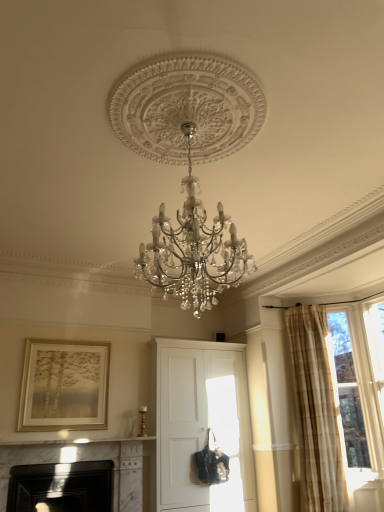
Question: Should I look upward or downward to see black marble fireplace at lower left, the 1th fireplace positioned from the left?

Choices:
 (A) up
 (B) down

Answer: (B)

Question: Is black marble fireplace at lower left, the 1th fireplace positioned from the left, further to the viewer compared to white marble fireplace at lower left, placed as the second fireplace when sorted from left to right?

Choices:
 (A) no
 (B) yes

Answer: (B)

Question: From the image's perspective, does black marble fireplace at lower left, the 1th fireplace positioned from the left, appear lower than white marble fireplace at lower left, placed as the second fireplace when sorted from left to right?

Choices:
 (A) yes
 (B) no

Answer: (A)

Question: Is black marble fireplace at lower left, arranged as the second fireplace when viewed from the right, surrounding white marble fireplace at lower left, placed as the second fireplace when sorted from left to right?

Choices:
 (A) yes
 (B) no

Answer: (A)

Question: From the image's perspective, is black marble fireplace at lower left, the 1th fireplace positioned from the left, over white marble fireplace at lower left, which appears as the 1th fireplace when viewed from the right?

Choices:
 (A) no
 (B) yes

Answer: (A)

Question: Is there a large distance between black marble fireplace at lower left, arranged as the second fireplace when viewed from the right, and white marble fireplace at lower left, which appears as the 1th fireplace when viewed from the right?

Choices:
 (A) yes
 (B) no

Answer: (B)

Question: Does black marble fireplace at lower left, arranged as the second fireplace when viewed from the right, have a lesser width compared to white marble fireplace at lower left, which appears as the 1th fireplace when viewed from the right?

Choices:
 (A) yes
 (B) no

Answer: (A)

Question: From a real-world perspective, is white matte cabinet at center below clear glass window at upper right?

Choices:
 (A) no
 (B) yes

Answer: (B)

Question: Considering the relative sizes of white matte cabinet at center and clear glass window at upper right in the image provided, is white matte cabinet at center thinner than clear glass window at upper right?

Choices:
 (A) no
 (B) yes

Answer: (A)

Question: Considering the relative sizes of white matte cabinet at center and clear glass window at upper right in the image provided, is white matte cabinet at center shorter than clear glass window at upper right?

Choices:
 (A) no
 (B) yes

Answer: (A)

Question: Is white matte cabinet at center positioned with its back to clear glass window at upper right?

Choices:
 (A) yes
 (B) no

Answer: (B)

Question: Considering the relative sizes of white matte cabinet at center and clear glass window at upper right in the image provided, is white matte cabinet at center wider than clear glass window at upper right?

Choices:
 (A) yes
 (B) no

Answer: (A)

Question: From a real-world perspective, is white matte cabinet at center located higher than clear glass window at upper right?

Choices:
 (A) yes
 (B) no

Answer: (B)

Question: From a real-world perspective, is white matte cabinet at center positioned under beige plaid curtain at right based on gravity?

Choices:
 (A) no
 (B) yes

Answer: (B)